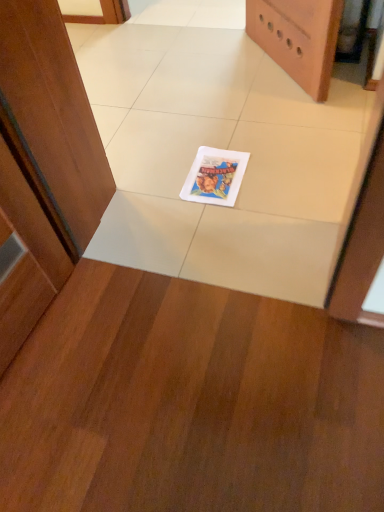
Question: Is the surface of white glossy tile at center in direct contact with matte white comic book at center?

Choices:
 (A) no
 (B) yes

Answer: (A)

Question: Is white glossy tile at center positioned far away from matte white comic book at center?

Choices:
 (A) yes
 (B) no

Answer: (B)

Question: Can you confirm if white glossy tile at center is positioned to the right of matte white comic book at center?

Choices:
 (A) yes
 (B) no

Answer: (B)

Question: From a real-world perspective, is white glossy tile at center located beneath matte white comic book at center?

Choices:
 (A) no
 (B) yes

Answer: (B)

Question: Can you confirm if white glossy tile at center is wider than matte white comic book at center?

Choices:
 (A) yes
 (B) no

Answer: (A)

Question: Could you tell me if white glossy tile at center is turned towards matte white comic book at center?

Choices:
 (A) yes
 (B) no

Answer: (A)

Question: Does matte white comic book at center appear on the right side of white glossy tile at center?

Choices:
 (A) yes
 (B) no

Answer: (A)

Question: From the image's perspective, is matte white comic book at center on top of white glossy tile at center?

Choices:
 (A) no
 (B) yes

Answer: (A)

Question: Can you confirm if matte white comic book at center is taller than white glossy tile at center?

Choices:
 (A) no
 (B) yes

Answer: (A)

Question: Does matte white comic book at center have a smaller size compared to white glossy tile at center?

Choices:
 (A) no
 (B) yes

Answer: (B)

Question: Can you confirm if matte white comic book at center is shorter than white glossy tile at center?

Choices:
 (A) no
 (B) yes

Answer: (B)

Question: From a real-world perspective, is matte white comic book at center over white glossy tile at center?

Choices:
 (A) no
 (B) yes

Answer: (B)

Question: Relative to matte white comic book at center, is white glossy tile at center in front or behind?

Choices:
 (A) behind
 (B) front

Answer: (B)